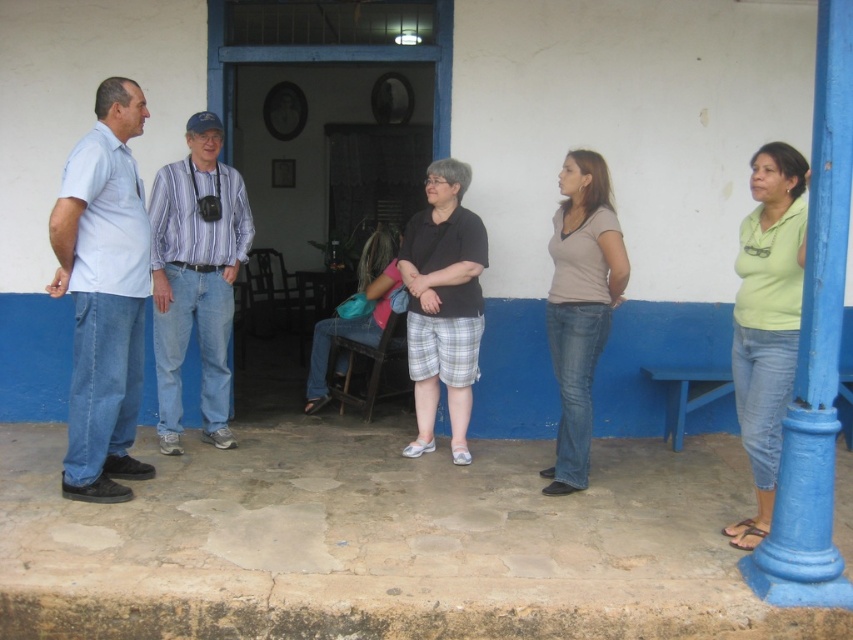
From the picture: You are standing at the origin of the coordinate system in the image. You need to walk to point A located at point (833,22) and point B located at point (178,352). Which point will you reach first if you walk straight ahead?

Point (833,22) is in front of point (178,352), so you will reach point A first.

You are a photographer trying to capture a group photo of the light blue cotton shirt at left and the green matte shirt at right. The camera you are using has a maximum focus range of 10 feet. Will you be able to focus on both subjects simultaneously?

The light blue cotton shirt at left is 9.71 feet from the green matte shirt at right. Since the distance between them is within the camera s 10 feet maximum focus range, you can focus on both subjects simultaneously.

You are a photographer trying to capture a clear shot of both the striped cotton shirt at center and the pink fabric at center. Since you want both to be in focus, which object should you focus on first to ensure the other is also sharp?

The striped cotton shirt at center is closer to the viewer than the pink fabric at center. To ensure both are in focus, you should focus on the striped cotton shirt at center first, as focusing on the closer object allows the depth of field to extend backward, potentially keeping the pink fabric at center in focus as well.